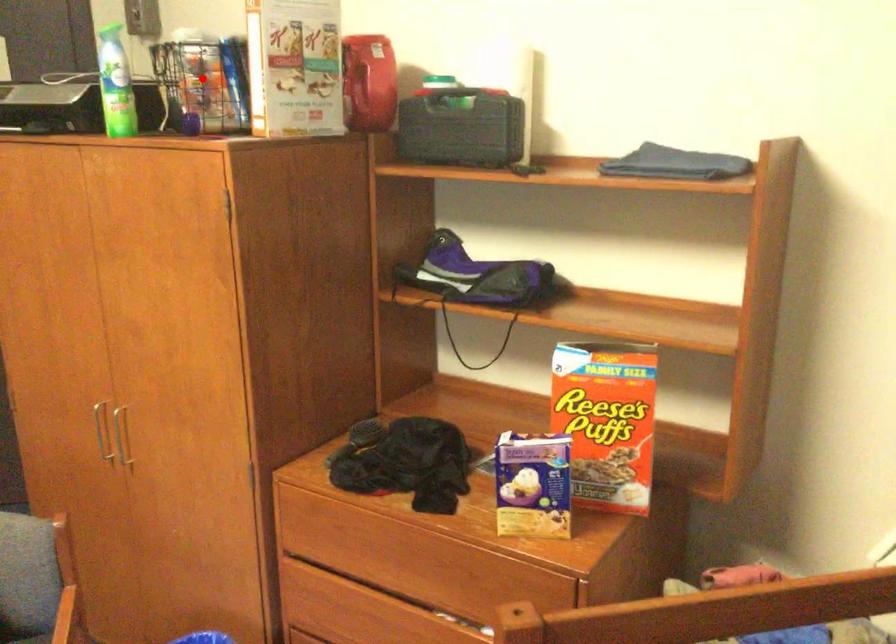
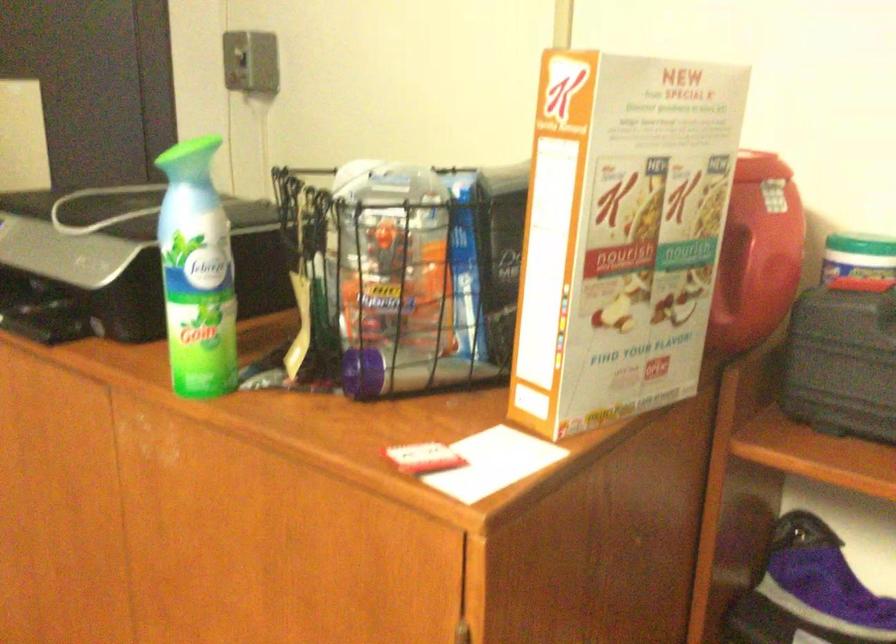
Question: I am providing you with two images of the same scene from different viewpoints. A red point is marked on the first image. At the location where the point appears in image 1, is it still visible in image 2?

Choices:
 (A) Yes
 (B) No

Answer: (A)